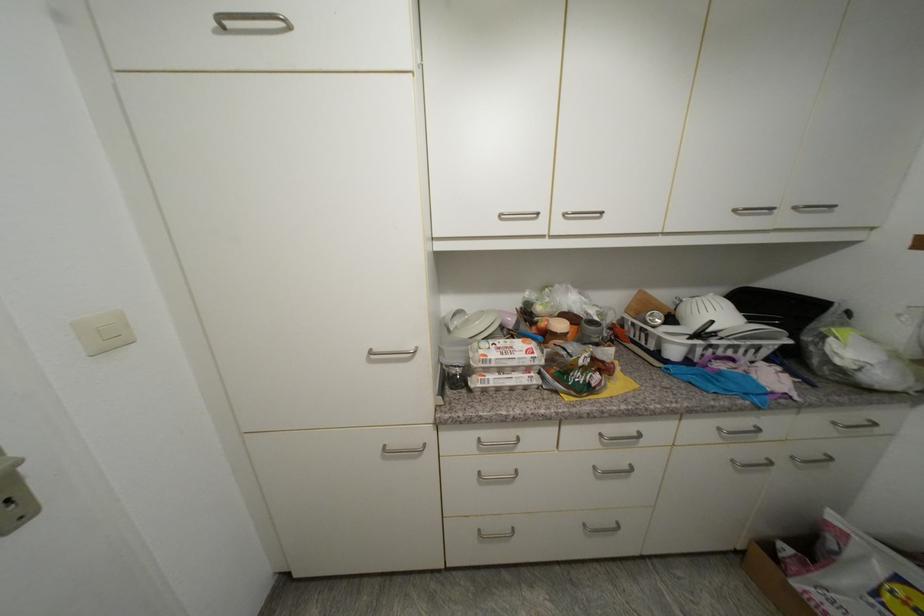
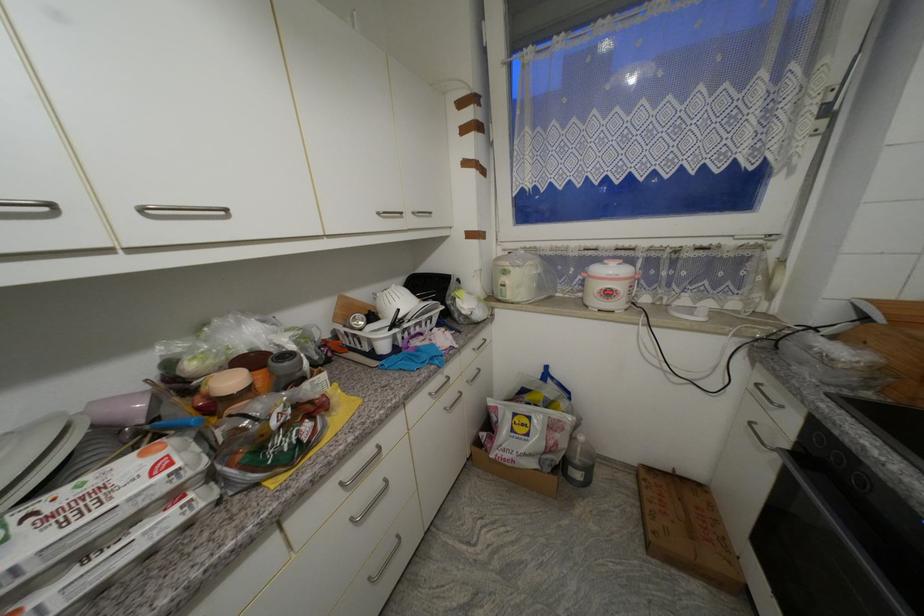
Locate, in the second image, the point that corresponds to the point at 533,371 in the first image.

(178, 498)